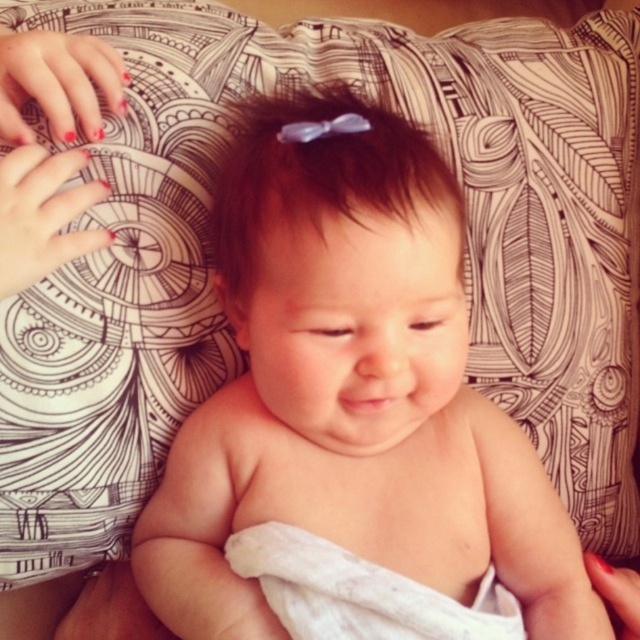
You are an artist trying to sketch the baby in the image. You want to place the brown matte hair bow at center accurately. Where should you position it on the canvas using coordinates?

The brown matte hair bow at center should be placed at coordinates approximately 0.278 on the x axis and 0.497 on the y axis.

Looking at this image, you are a photographer taking a closeup shot of the baby. The smooth skin baby at center and the brown matte hair bow at center are both in focus. Which object would appear larger in the photo?

The smooth skin baby at center would appear larger in the photo because it is bigger than the brown matte hair bow at center.